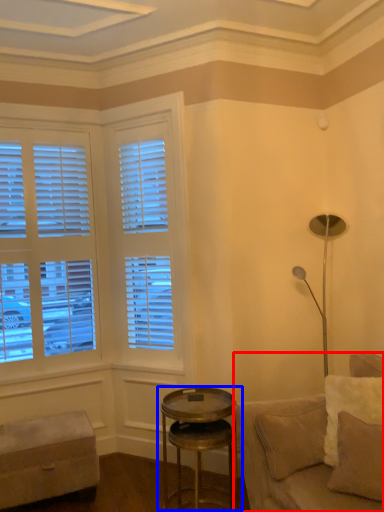
Question: Which object appears farthest to the camera in this image, studio couch (highlighted by a red box) or table (highlighted by a blue box)?

Choices:
 (A) studio couch
 (B) table

Answer: (B)